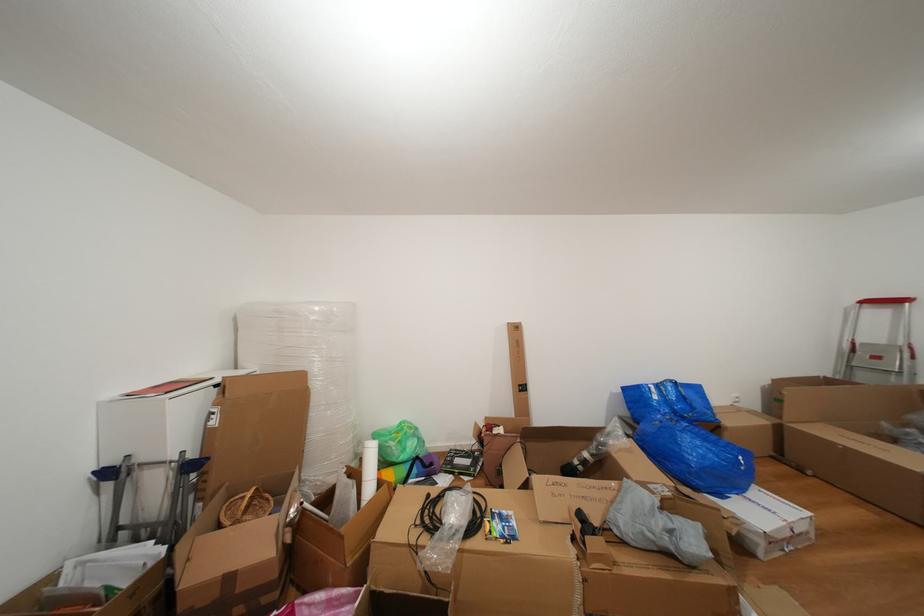
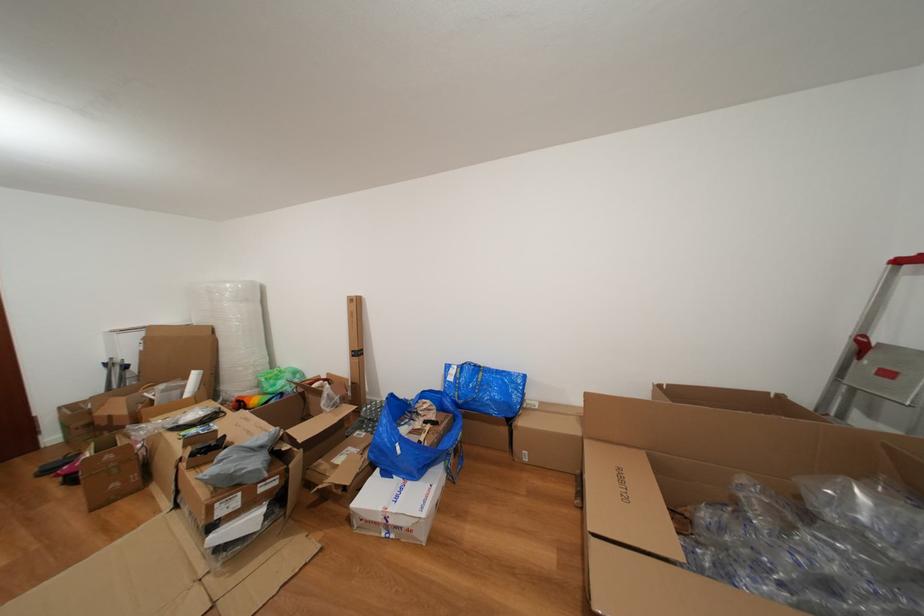
Find the pixel in the second image that matches point (412, 454) in the first image.

(283, 390)